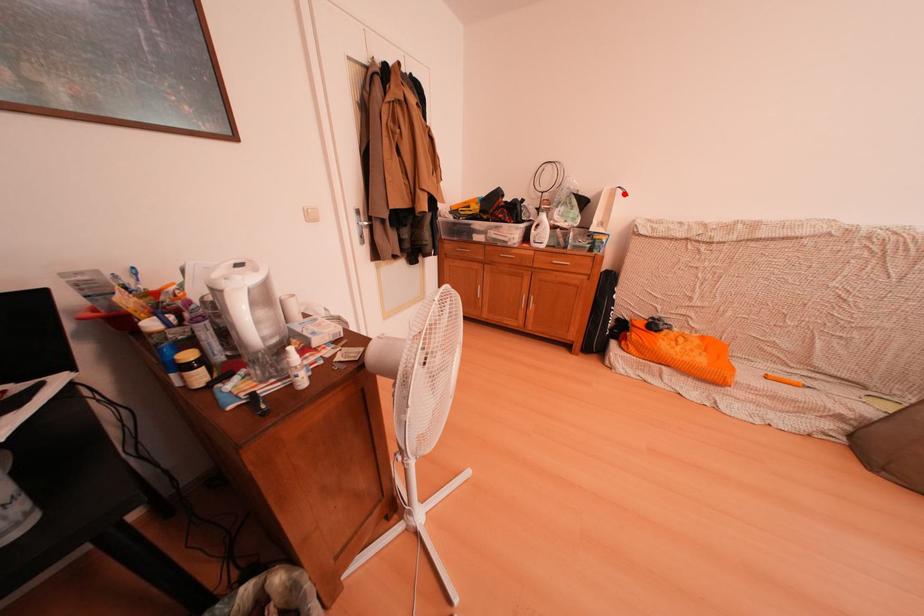
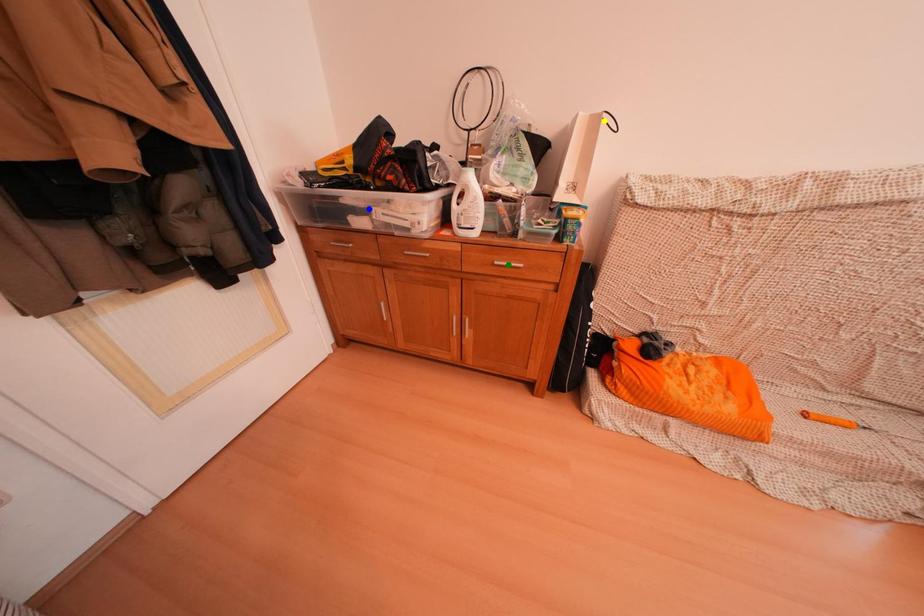
Question: I am providing you with two images of the same scene from different viewpoints. A red point is marked on the first image. You are given multiple points on the second image. Which mark in image 2 goes with the point in image 1?

Choices:
 (A) blue point
 (B) yellow point
 (C) green point

Answer: (B)